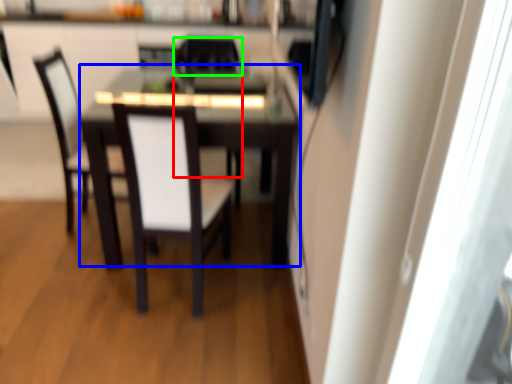
Question: Estimate the real-world distances between objects in this image. Which object is farther from chair (highlighted by a red box), table (highlighted by a blue box) or chair (highlighted by a green box)?

Choices:
 (A) table
 (B) chair

Answer: (A)